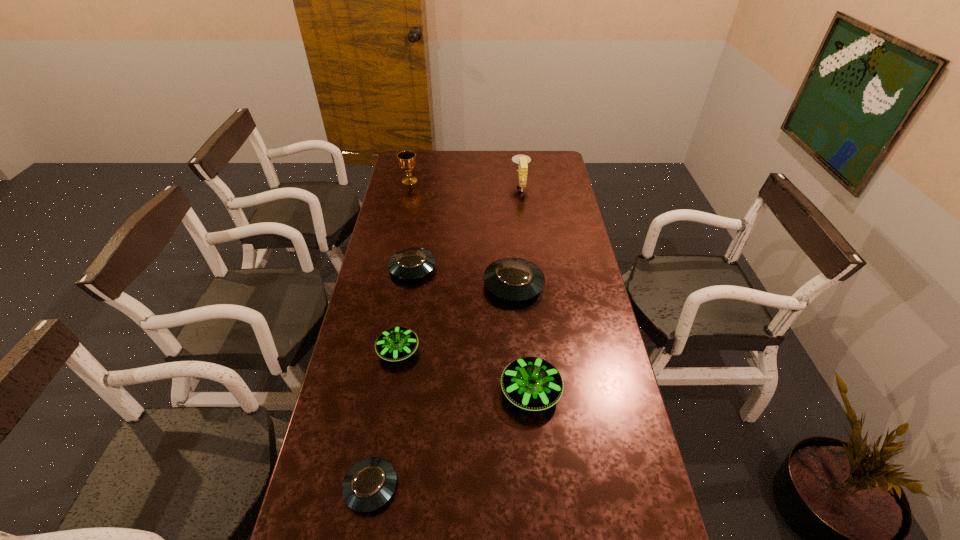
This screenshot has width=960, height=540. Find the location of `vacant space at the left edge`. vacant space at the left edge is located at coordinates (418, 185).

Where is `vacant area at the right edge of the desktop`? Image resolution: width=960 pixels, height=540 pixels. vacant area at the right edge of the desktop is located at coordinates (596, 333).

I want to click on vacant position at the far left corner of the desktop, so click(418, 168).

In the image, there is a desktop. At what (x,y) coordinates should I click in order to perform the action: click on vacant space at the far right corner. Please return your answer as a coordinate pair (x, y). The image size is (960, 540). Looking at the image, I should click on (550, 152).

Locate an element on the screen. This screenshot has width=960, height=540. free spot between the nearest gray saucer and the second smallest gray saucer is located at coordinates (392, 377).

You are a GUI agent. You are given a task and a screenshot of the screen. Output one action in this format:
    pyautogui.click(x=<x>, y=<y>)
    Task: Click on the free space between the sponge and the biggest gray saucer
    Image resolution: width=960 pixels, height=540 pixels.
    Given the screenshot: What is the action you would take?
    pyautogui.click(x=517, y=235)

The image size is (960, 540). I want to click on free spot between the second smallest gray saucer and the left green saucer, so click(405, 309).

At what (x,y) coordinates should I click in order to perform the action: click on vacant point located between the nearest object and the smaller green saucer. Please return your answer as a coordinate pair (x, y). The height and width of the screenshot is (540, 960). Looking at the image, I should click on (384, 418).

The height and width of the screenshot is (540, 960). What are the coordinates of `vacant area that lies between the bigger green saucer and the left green saucer` in the screenshot? It's located at [x=465, y=370].

The height and width of the screenshot is (540, 960). I want to click on blank region between the rightmost gray saucer and the bigger green saucer, so click(522, 338).